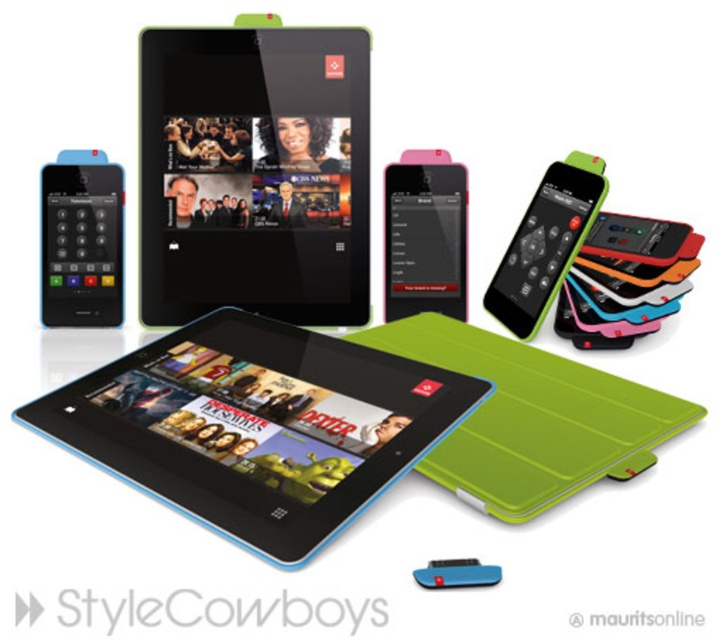
Is black glossy tablet at center thinner than green matte/ipod at upper right?

Incorrect, black glossy tablet at center's width is not less than green matte/ipod at upper right's.

Who is more distant from viewer, (201, 122) or (564, 236)?

Positioned behind is point (201, 122).

Is point (262, 269) in front of point (533, 241)?

Yes, it is.

Identify the location of black glossy tablet at center. This screenshot has width=719, height=640. click(x=255, y=173).

Between black glossy tablet at center and pink glossy ipod at center, which one is positioned lower?

pink glossy ipod at center is below.

Is black glossy tablet at center above pink glossy ipod at center?

Yes.

Who is more distant from viewer, (237, 51) or (441, 150)?

Point (441, 150)

Locate an element on the screen. The height and width of the screenshot is (640, 719). black glossy tablet at center is located at coordinates (255, 173).

Can you confirm if blue matte tablet at center is wider than blue matte/ipod at left?

Yes, blue matte tablet at center is wider than blue matte/ipod at left.

Which is behind, point (421, 397) or point (75, 252)?

The point (75, 252) is behind.

Describe the element at coordinates (257, 426) in the screenshot. This screenshot has height=640, width=719. I see `blue matte tablet at center` at that location.

This screenshot has height=640, width=719. In order to click on blue matte tablet at center in this screenshot , I will do `click(257, 426)`.